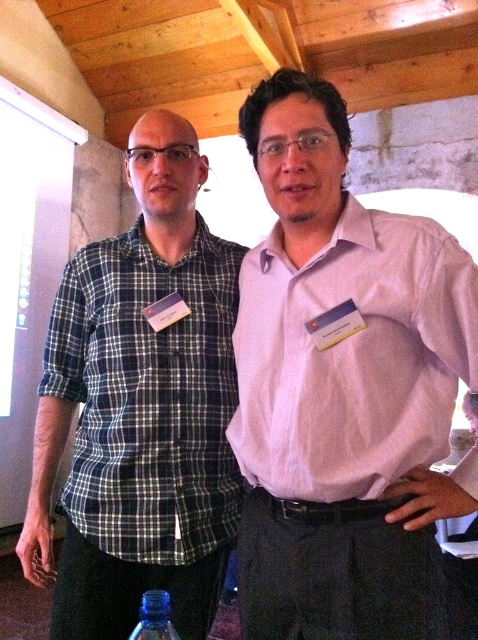
You are a photographer at the event and need to capture a photo of both the plaid cotton shirt at left and the transparent plastic bottle at lower center in the same frame. The camera you are using has a minimum focus distance of 20 inches. Can you take the photo without moving either object?

The plaid cotton shirt at left and transparent plastic bottle at lower center are 19.43 inches apart from each other. Since the distance between them is less than the camera minimum focus distance of 20 inches, you cannot take the photo without moving either object.

You are a photographer at the event and need to adjust the camera angle so that both the pink smooth shirt at center and the plaid cotton shirt at left appear at the same height in the photo. Given their actual heights, what adjustment should you make?

The pink smooth shirt at center has a lesser height compared to the plaid cotton shirt at left. To make them appear equal in height in the photo, you should angle the camera slightly downward to compensate for the height difference between the two shirts.